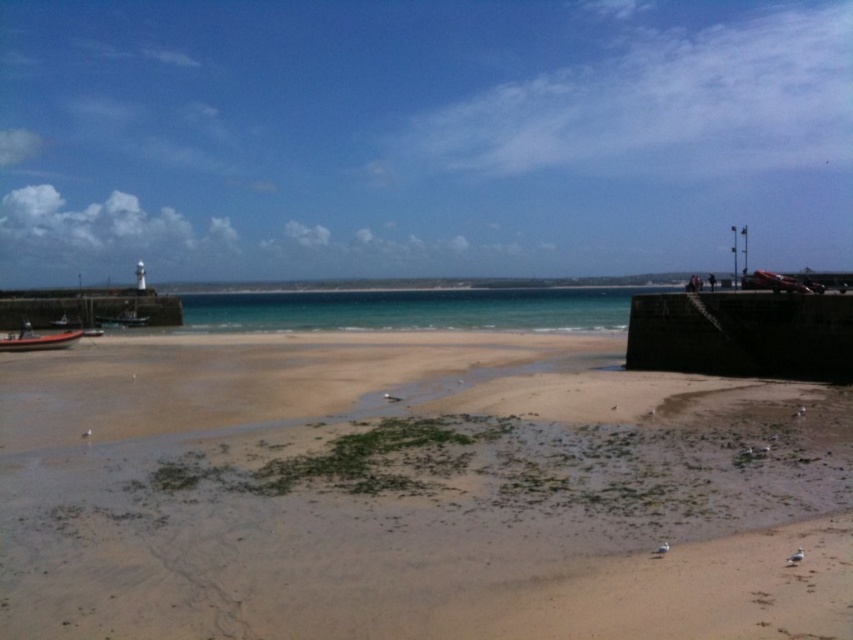
Question: Can you confirm if brown sandy beach at lower center is positioned to the left of orange fiberglass boat at lower left?

Choices:
 (A) yes
 (B) no

Answer: (B)

Question: Considering the relative positions of brown sandy beach at lower center and orange fiberglass boat at lower left in the image provided, where is brown sandy beach at lower center located with respect to orange fiberglass boat at lower left?

Choices:
 (A) left
 (B) right

Answer: (B)

Question: Can you confirm if brown sandy beach at lower center is positioned below orange fiberglass boat at lower left?

Choices:
 (A) yes
 (B) no

Answer: (A)